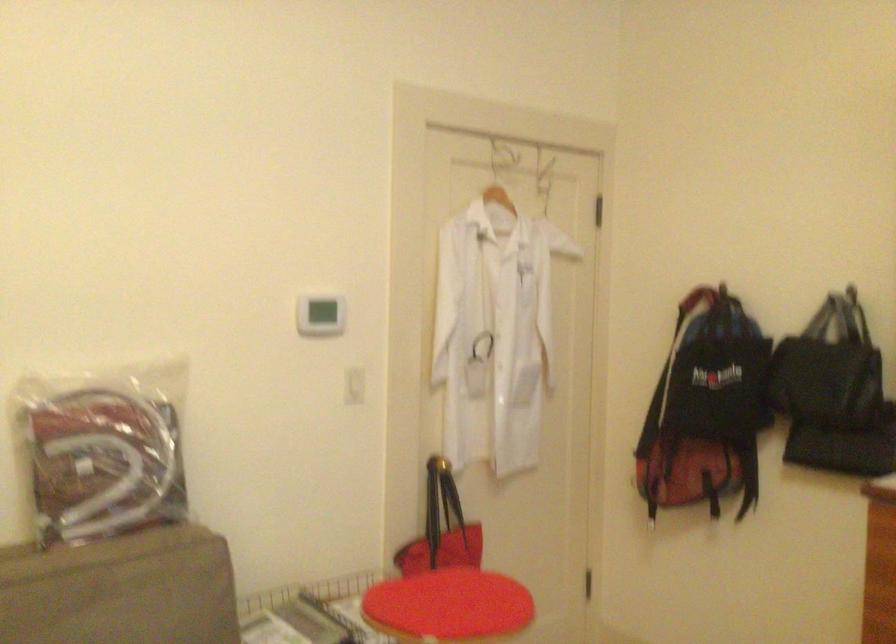
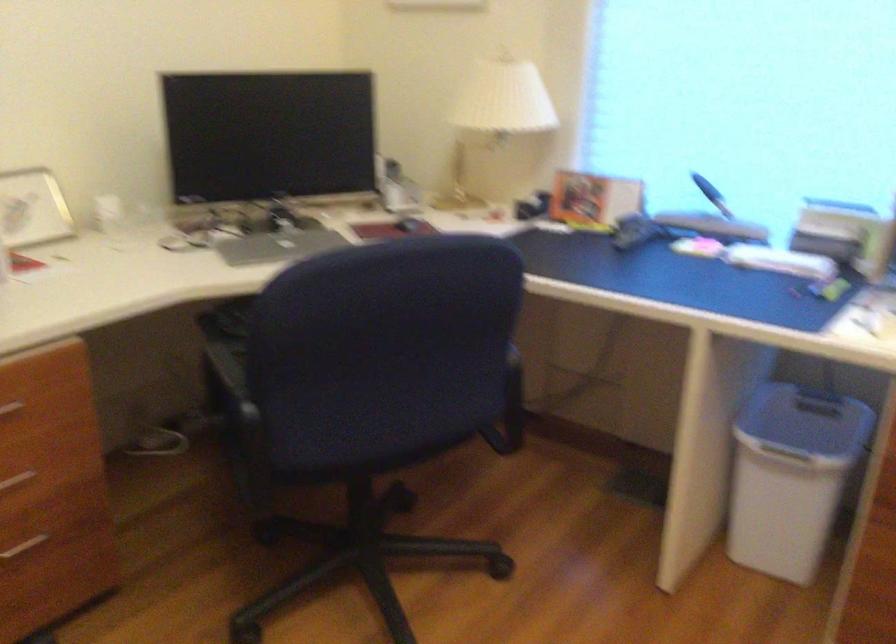
First-person continuous shooting, in which direction is the camera rotating?

The camera's rotation is toward right-down.